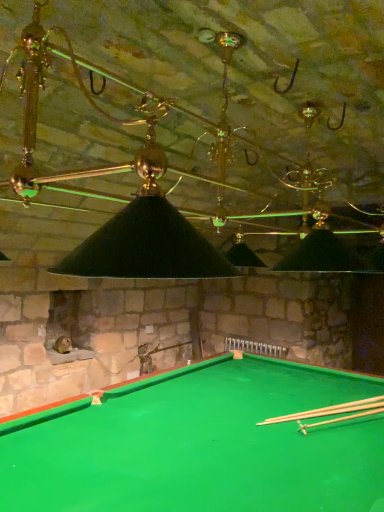
Question: Considering the relative sizes of light brown wooden cue at bottom right and green felt billiard table at lower center in the image provided, is light brown wooden cue at bottom right taller than green felt billiard table at lower center?

Choices:
 (A) yes
 (B) no

Answer: (B)

Question: From the image's perspective, is light brown wooden cue at bottom right beneath green felt billiard table at lower center?

Choices:
 (A) no
 (B) yes

Answer: (A)

Question: Is the position of light brown wooden cue at bottom right more distant than that of green felt billiard table at lower center?

Choices:
 (A) no
 (B) yes

Answer: (B)

Question: Is light brown wooden cue at bottom right to the left of green felt billiard table at lower center from the viewer's perspective?

Choices:
 (A) yes
 (B) no

Answer: (B)

Question: Is green felt billiard table at lower center surrounded by light brown wooden cue at bottom right?

Choices:
 (A) yes
 (B) no

Answer: (B)

Question: Is light brown wooden cue at bottom right outside green felt billiard table at lower center?

Choices:
 (A) yes
 (B) no

Answer: (B)

Question: From a real-world perspective, is green felt billiard table at lower center beneath light brown wooden cue at bottom right?

Choices:
 (A) yes
 (B) no

Answer: (A)

Question: Considering the relative sizes of green felt billiard table at lower center and light brown wooden cue at bottom right in the image provided, is green felt billiard table at lower center bigger than light brown wooden cue at bottom right?

Choices:
 (A) yes
 (B) no

Answer: (A)

Question: Considering the relative sizes of green felt billiard table at lower center and light brown wooden cue at bottom right in the image provided, is green felt billiard table at lower center shorter than light brown wooden cue at bottom right?

Choices:
 (A) no
 (B) yes

Answer: (A)

Question: Would you consider green felt billiard table at lower center to be distant from light brown wooden cue at bottom right?

Choices:
 (A) no
 (B) yes

Answer: (A)

Question: From a real-world perspective, is green felt billiard table at lower center on light brown wooden cue at bottom right?

Choices:
 (A) no
 (B) yes

Answer: (A)

Question: Can you confirm if green felt billiard table at lower center is taller than light brown wooden cue at bottom right?

Choices:
 (A) no
 (B) yes

Answer: (B)

Question: Looking at their shapes, would you say light brown wooden cue at bottom right is wider or thinner than green felt billiard table at lower center?

Choices:
 (A) wide
 (B) thin

Answer: (B)